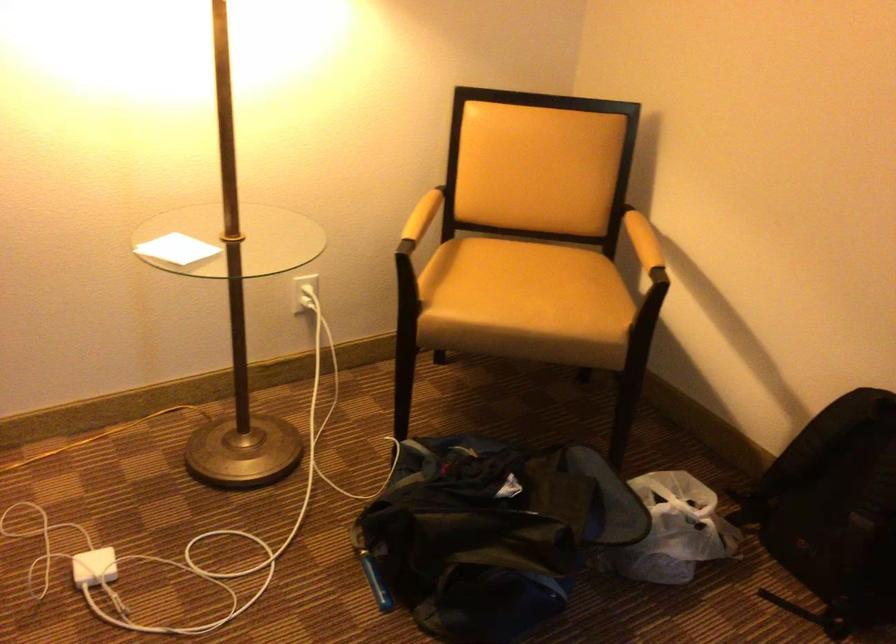
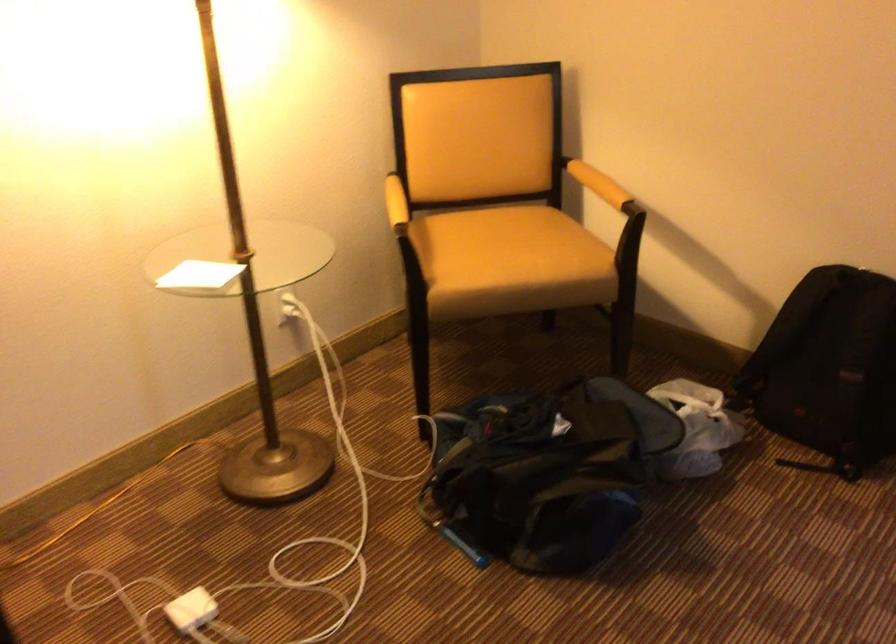
Locate, in the second image, the point that corresponds to (x=416, y=216) in the first image.

(395, 203)